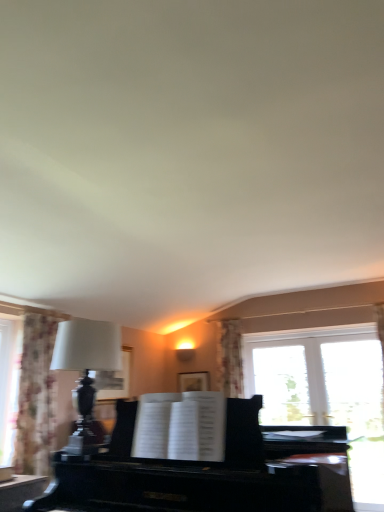
Question: Would you say matte black lamp at left contains floral fabric curtain at left?

Choices:
 (A) yes
 (B) no

Answer: (B)

Question: Does matte black lamp at left turn towards floral fabric curtain at left?

Choices:
 (A) yes
 (B) no

Answer: (B)

Question: Is matte black lamp at left positioned behind floral fabric curtain at left?

Choices:
 (A) no
 (B) yes

Answer: (A)

Question: Is floral fabric curtain at left at the back of matte black lamp at left?

Choices:
 (A) no
 (B) yes

Answer: (A)

Question: Is matte black lamp at left outside of floral fabric curtain at left?

Choices:
 (A) yes
 (B) no

Answer: (A)

Question: From the image's perspective, is matte black lamp at left positioned above or below black polished piano at center?

Choices:
 (A) below
 (B) above

Answer: (B)

Question: Does point (92, 327) appear closer or farther from the camera than point (112, 437)?

Choices:
 (A) closer
 (B) farther

Answer: (A)

Question: Which is correct: matte black lamp at left is inside black polished piano at center, or outside of it?

Choices:
 (A) inside
 (B) outside

Answer: (A)

Question: Is matte black lamp at left bigger or smaller than black polished piano at center?

Choices:
 (A) small
 (B) big

Answer: (A)

Question: Would you say floral fabric curtain at left is to the left or to the right of black polished piano at center in the picture?

Choices:
 (A) right
 (B) left

Answer: (B)

Question: From a real-world perspective, is floral fabric curtain at left above or below black polished piano at center?

Choices:
 (A) above
 (B) below

Answer: (A)

Question: From the image's perspective, is floral fabric curtain at left located above or below black polished piano at center?

Choices:
 (A) below
 (B) above

Answer: (B)

Question: Considering their positions, is floral fabric curtain at left located in front of or behind black polished piano at center?

Choices:
 (A) front
 (B) behind

Answer: (B)

Question: Relative to floral fabric curtain at left, is matte black lamp at left in front or behind?

Choices:
 (A) front
 (B) behind

Answer: (A)

Question: Based on their positions, is matte black lamp at left located to the left or right of floral fabric curtain at left?

Choices:
 (A) left
 (B) right

Answer: (B)